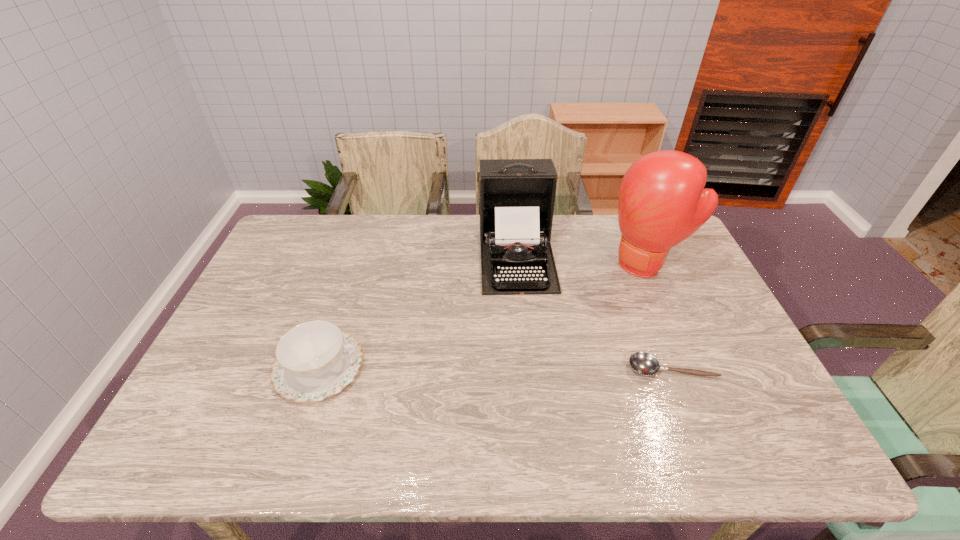
Identify the location of chinaware. (314, 360).

The height and width of the screenshot is (540, 960). What are the coordinates of `the leftmost object` in the screenshot? It's located at (314, 360).

Where is `ladle`? ladle is located at coordinates (643, 363).

Find the location of a particular element. the second tallest object is located at coordinates (517, 196).

What are the coordinates of `the third object from right to left` in the screenshot? It's located at (517, 196).

Where is `the tallest object`? the tallest object is located at coordinates (662, 201).

Find the location of a particular element. The width and height of the screenshot is (960, 540). free space located 0.220m on the handle side of the leftmost object is located at coordinates (449, 368).

Locate an element on the screen. vacant space positioned 0.400m on the back of the shortest object is located at coordinates (629, 258).

Locate an element on the screen. vacant position located inside the open case of the second tallest object is located at coordinates (526, 326).

This screenshot has width=960, height=540. I want to click on free space located 0.400m inside the open case of the second tallest object, so click(x=538, y=417).